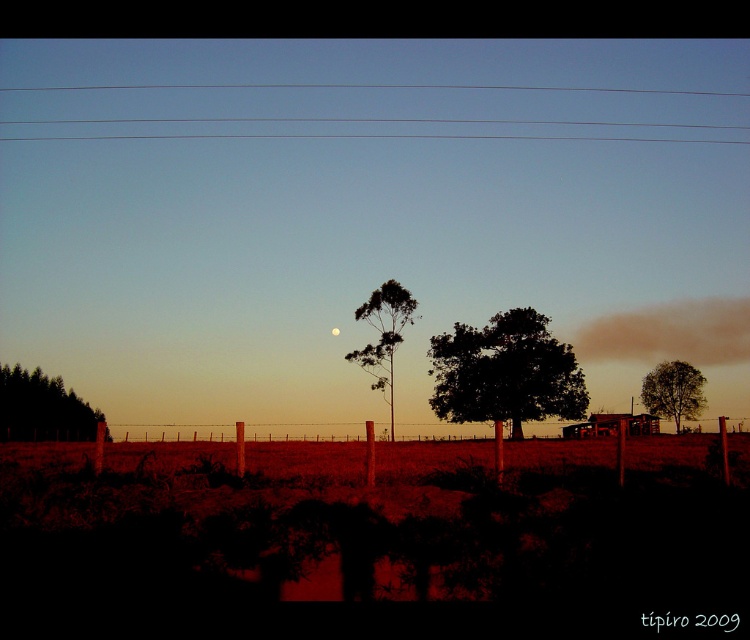
Where is the green leafy tree at center located in the image?

The green leafy tree at center is located at point (384, 336) in the image.

You are standing in the rural landscape scene. You see two points, point (489, 349) and point (372, 307). Which point is closer to you?

Point (489, 349) is further to the viewer than point (372, 307). Therefore, point (372, 307) is closer to you.

You are an artist planning to paint the scene. You need to decide which area to focus on for the trees. Which tree has a wider spread in terms of width between the green matte trees at left and the green leafy tree at center?

The green matte trees at left have a wider spread in terms of width compared to the green leafy tree at center as stated in the description.